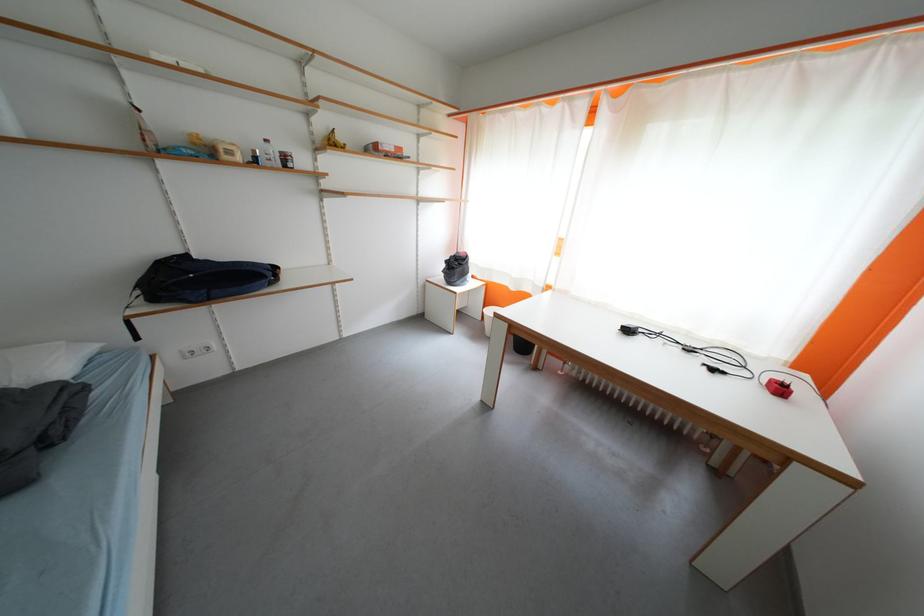
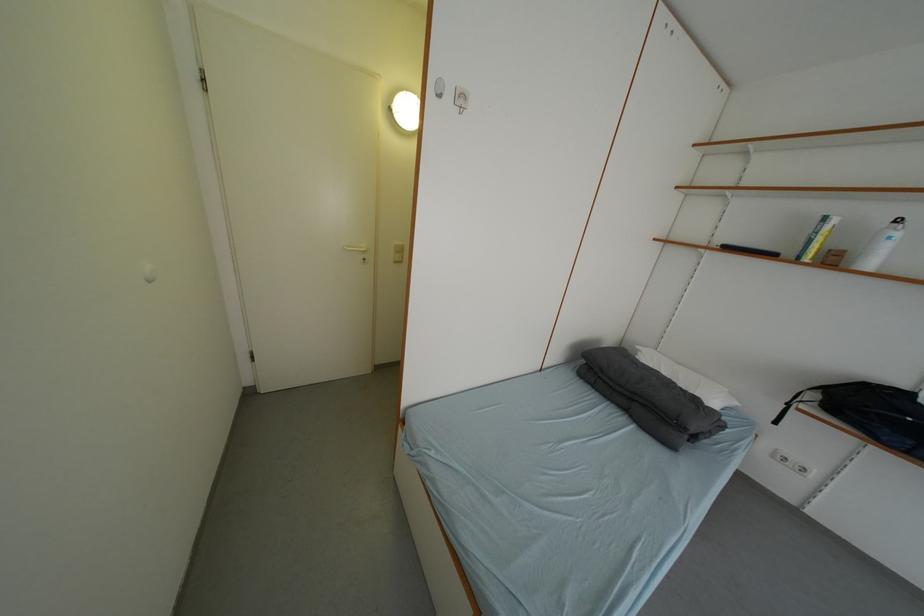
The first image is from the beginning of the video and the second image is from the end. How did the camera likely rotate when shooting the video?

The camera rotated toward left-down.